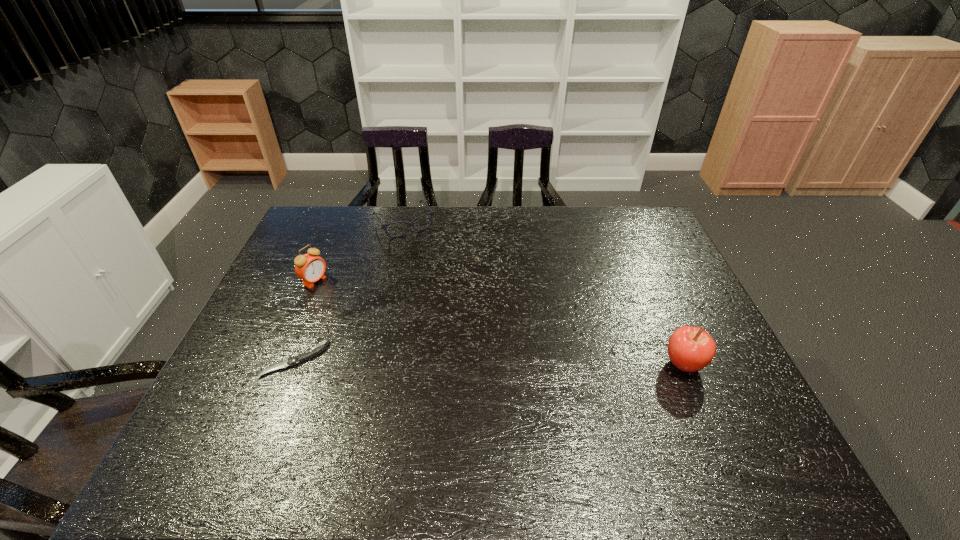
Identify the location of vacant space at the right edge of the desktop. (648, 246).

The height and width of the screenshot is (540, 960). I want to click on vacant area at the far left corner, so click(352, 214).

Locate an element on the screen. The width and height of the screenshot is (960, 540). vacant space at the near left corner is located at coordinates (269, 420).

You are a GUI agent. You are given a task and a screenshot of the screen. Output one action in this format:
    pyautogui.click(x=<x>, y=<y>)
    Task: Click on the vacant region at the far right corner
    
    Given the screenshot: What is the action you would take?
    [x=633, y=212]

You are a GUI agent. You are given a task and a screenshot of the screen. Output one action in this format:
    pyautogui.click(x=<x>, y=<y>)
    Task: Click on the vacant space that's between the shortest object and the apple
    The width and height of the screenshot is (960, 540).
    Given the screenshot: What is the action you would take?
    pyautogui.click(x=490, y=362)

Where is `vacant area that lies between the alarm clock and the spectacles`? Image resolution: width=960 pixels, height=540 pixels. vacant area that lies between the alarm clock and the spectacles is located at coordinates (360, 252).

At what (x,y) coordinates should I click in order to perform the action: click on free area in between the pocketknife and the third tallest object. Please return your answer as a coordinate pair (x, y). This screenshot has height=540, width=960. Looking at the image, I should click on (349, 291).

What are the coordinates of `vacant area that lies between the farthest object and the rightmost object` in the screenshot? It's located at (544, 294).

Identify the location of empty space between the alarm clock and the third object from left to right. (360, 252).

Locate an element on the screen. This screenshot has height=540, width=960. vacant point located between the shortest object and the alarm clock is located at coordinates (305, 320).